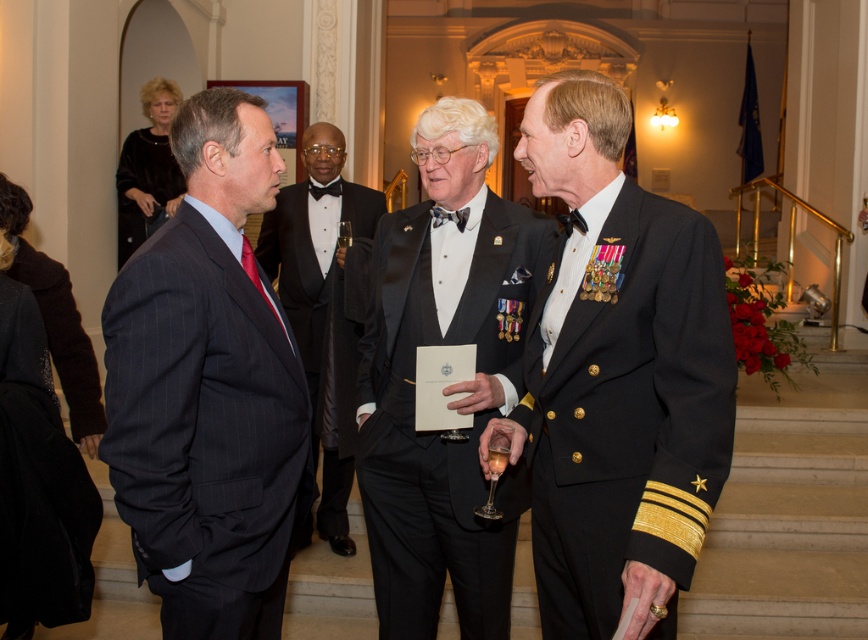
Question: Is shiny black uniform at center positioned before dark pinstripe suit at left?

Choices:
 (A) yes
 (B) no

Answer: (A)

Question: Does shiny black uniform at center have a larger size compared to shiny black suit at center?

Choices:
 (A) yes
 (B) no

Answer: (A)

Question: Which of the following is the farthest from the observer?

Choices:
 (A) shiny black suit at center
 (B) shiny black uniform at center

Answer: (A)

Question: Which point appears farthest from the camera in this image?

Choices:
 (A) (400, 376)
 (B) (602, 468)
 (C) (265, 620)

Answer: (A)

Question: Does shiny black uniform at center appear over shiny black suit at center?

Choices:
 (A) no
 (B) yes

Answer: (B)

Question: Which point is closer to the camera?

Choices:
 (A) (235, 244)
 (B) (525, 224)

Answer: (A)